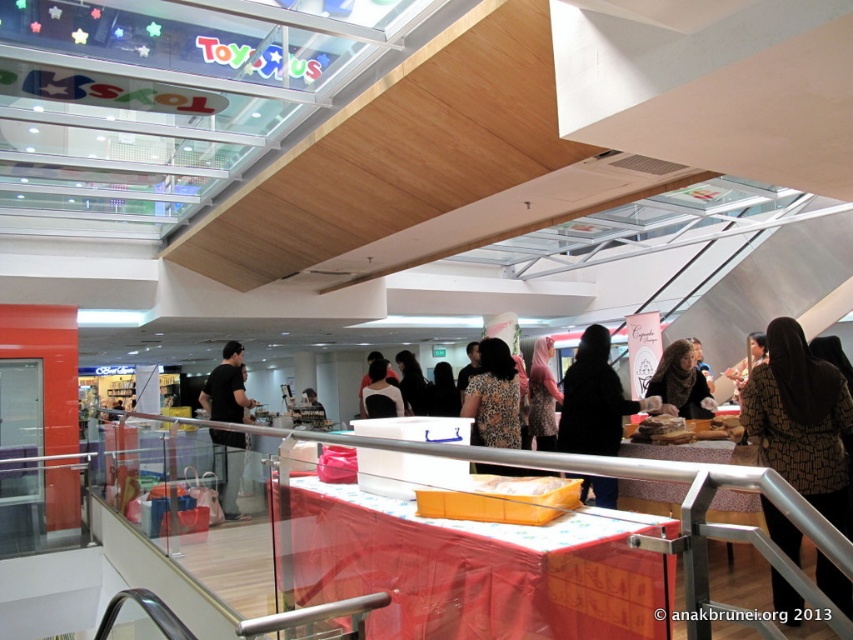
Between brown printed blouse at center and brown printed dress at center, which one has less height?

brown printed dress at center is shorter.

Can you confirm if brown printed blouse at center is taller than brown printed dress at center?

Indeed, brown printed blouse at center has a greater height compared to brown printed dress at center.

Is point (830, 385) behind point (508, 413)?

No, it is in front of (508, 413).

What are the coordinates of `brown printed blouse at center` in the screenshot? It's located at (799, 419).

Find the location of a particular element. Image resolution: width=853 pixels, height=640 pixels. brown printed blouse at center is located at coordinates (799, 419).

Is point (834, 433) more distant than point (548, 444)?

No, (834, 433) is closer to viewer.

Is point (775, 388) positioned behind point (544, 381)?

No.

Image resolution: width=853 pixels, height=640 pixels. What are the coordinates of `brown printed blouse at center` in the screenshot? It's located at (799, 419).

Which is more to the right, brown printed blouse at center or black hair at center?

brown printed blouse at center

The image size is (853, 640). What do you see at coordinates (799, 419) in the screenshot?
I see `brown printed blouse at center` at bounding box center [799, 419].

Where is `brown printed blouse at center`? The height and width of the screenshot is (640, 853). brown printed blouse at center is located at coordinates (799, 419).

Locate an element on the screen. This screenshot has width=853, height=640. brown printed blouse at center is located at coordinates (799, 419).